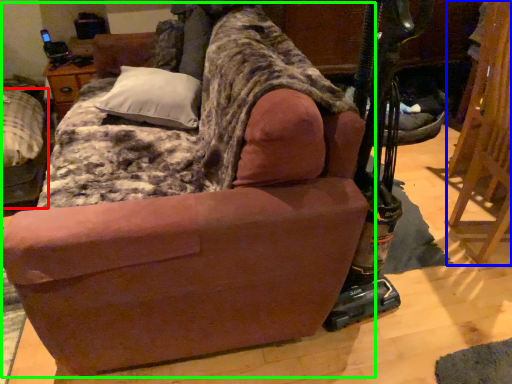
Question: Based on their relative distances, which object is nearer to furniture (highlighted by a red box)? Choose from folding chair (highlighted by a blue box) and studio couch (highlighted by a green box).

Choices:
 (A) folding chair
 (B) studio couch

Answer: (B)